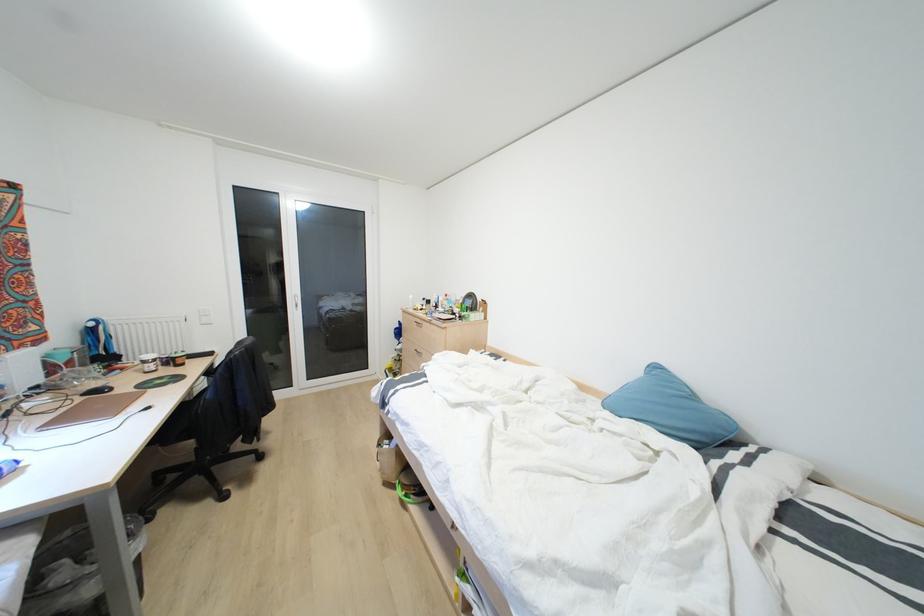
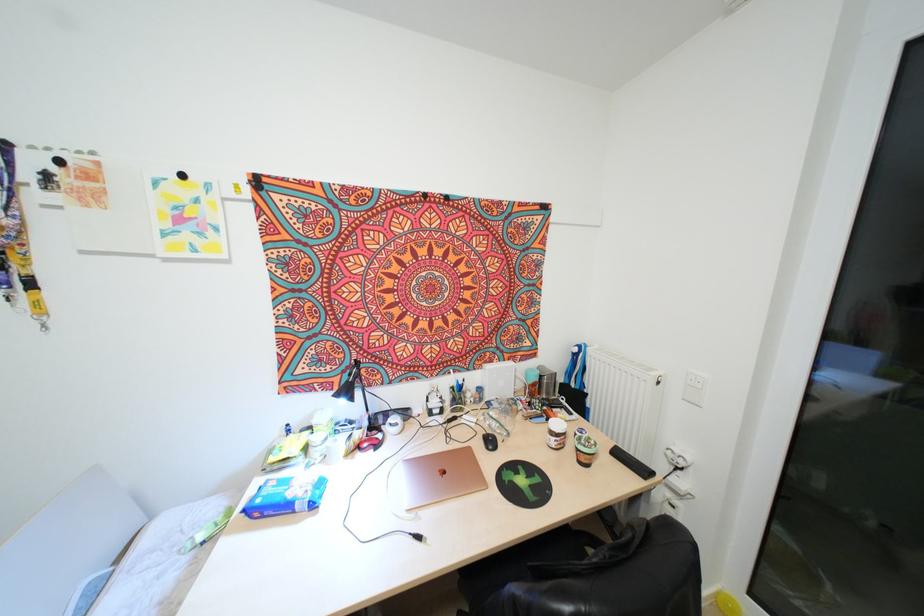
Find the pixel in the second image that matches the point at 209,353 in the first image.

(642, 471)